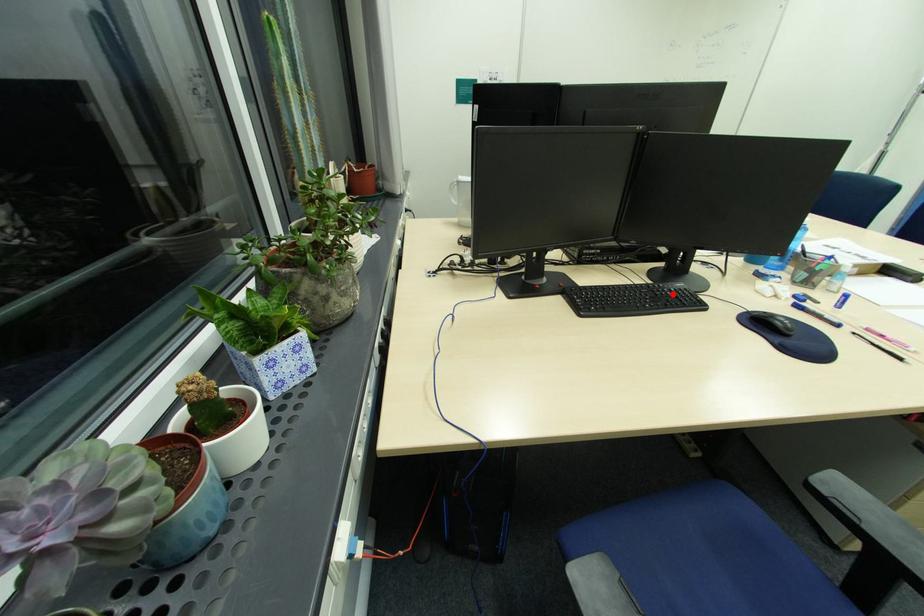
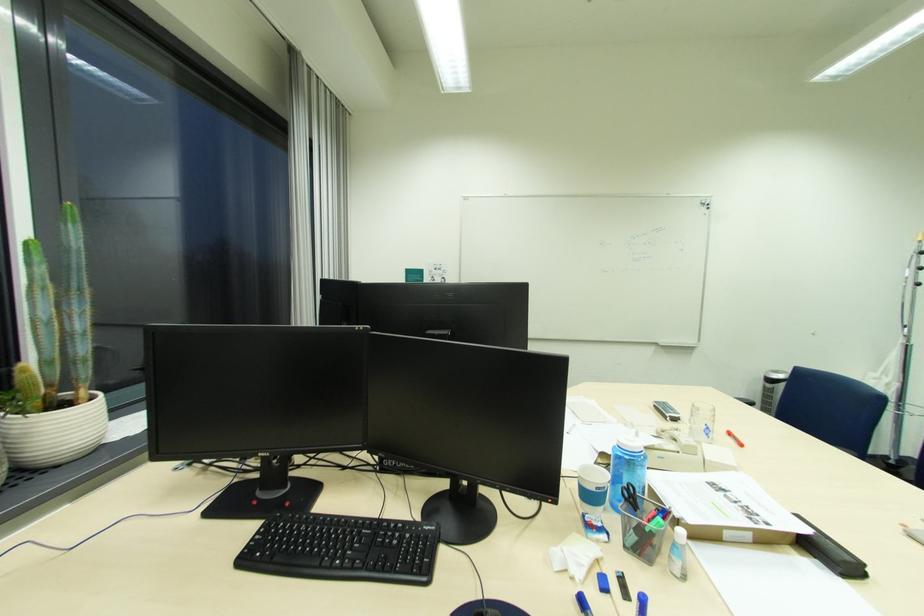
The point at the highlighted location is marked in the first image. Where is the corresponding point in the second image?

(396, 541)